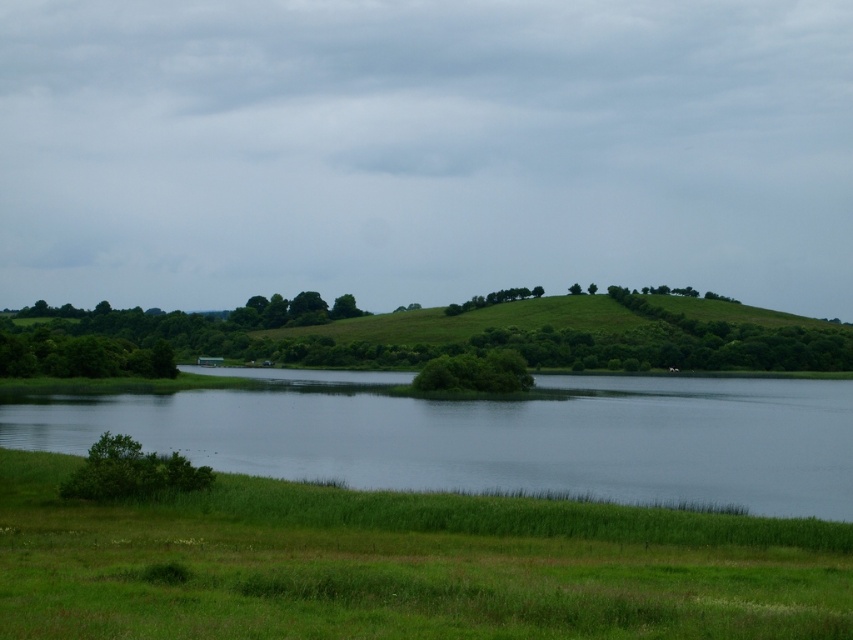
Question: Observing the image, what is the correct spatial positioning of green grassy water at lower left in reference to green leafy bush at center?

Choices:
 (A) above
 (B) below

Answer: (B)

Question: Which point is farther from the camera taking this photo?

Choices:
 (A) (207, 468)
 (B) (463, 330)
 (C) (576, 625)
 (D) (828, 477)

Answer: (B)

Question: Does green grassy at lower center have a smaller size compared to green leafy bush at lower left?

Choices:
 (A) no
 (B) yes

Answer: (A)

Question: Which point is farther to the camera?

Choices:
 (A) (129, 444)
 (B) (766, 365)

Answer: (B)

Question: Which is farther from the green leafy bush at center?

Choices:
 (A) green grassy at lower center
 (B) green grassy water at lower left
 (C) green leafy bush at lower left

Answer: (A)

Question: Can you confirm if green leafy trees at center is positioned below green leafy bush at center?

Choices:
 (A) no
 (B) yes

Answer: (A)